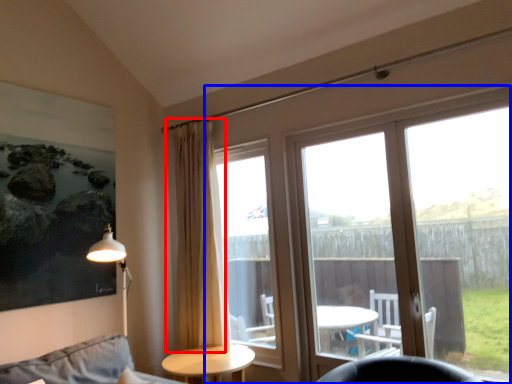
Question: Which object appears closest to the camera in this image, curtain (highlighted by a red box) or window (highlighted by a blue box)?

Choices:
 (A) curtain
 (B) window

Answer: (B)